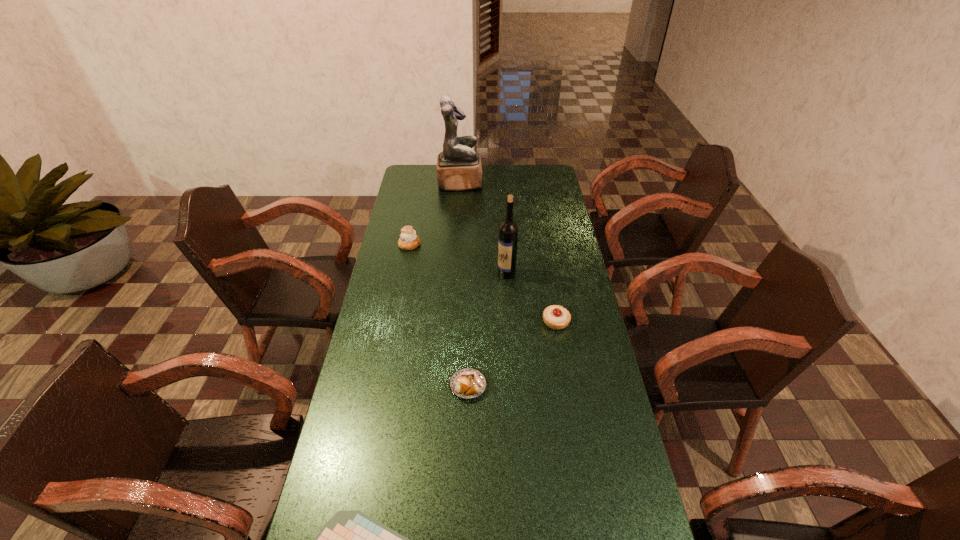
The height and width of the screenshot is (540, 960). Identify the location of the farthest object. (459, 167).

Find the location of a particular element. The width and height of the screenshot is (960, 540). sculpture is located at coordinates (459, 167).

This screenshot has width=960, height=540. I want to click on the fourth nearest object, so click(x=508, y=231).

Where is `the fifth shortest object`? This screenshot has height=540, width=960. the fifth shortest object is located at coordinates (508, 231).

Find the location of `the tallest pastry`. the tallest pastry is located at coordinates (409, 240).

Where is `the farthest pastry`? The image size is (960, 540). the farthest pastry is located at coordinates (409, 240).

Identify the location of the rightmost object. (556, 317).

This screenshot has width=960, height=540. I want to click on the second nearest pastry, so click(556, 317).

The width and height of the screenshot is (960, 540). Find the location of `the nearest pastry`. the nearest pastry is located at coordinates (468, 383).

Identify the location of the second pastry from left to right. (468, 383).